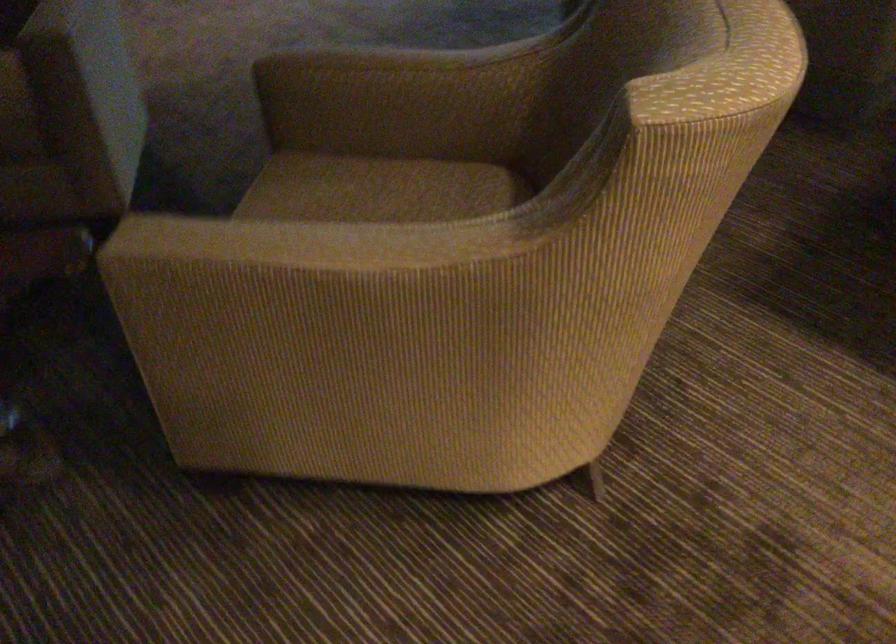
I want to click on chair sitting surface, so click(380, 187).